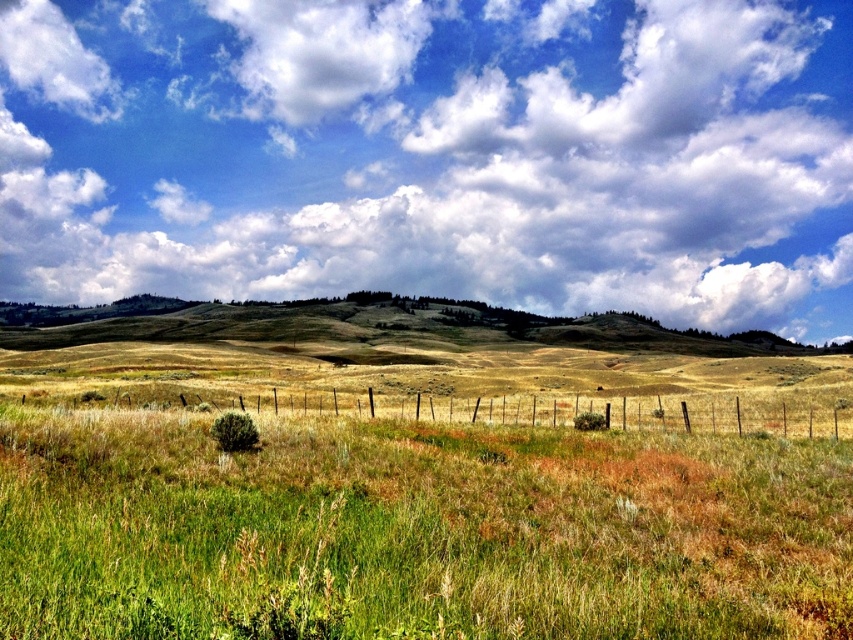
You are standing in the rural landscape and want to walk from the point closer to you to the point further away. Which path would you take between the two points, point [102,8] and point [325,634]?

You should walk from point [102,8] to point [325,634] because point [102,8] is closer to you than point [325,634], so the path goes from the closer point to the farther one.

You are a farmer looking at the sky and the fence in your field. You want to know if the white fluffy cloud at upper center is wider than the brown wire fence at center. Can you tell me?

The white fluffy cloud at upper center is wider than the brown wire fence at center according to the description.